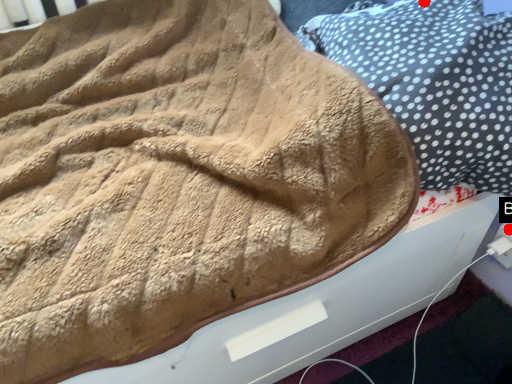
Question: Two points are circled on the image, labeled by A and B beside each circle. Which point is farther to the camera?

Choices:
 (A) A is further
 (B) B is further

Answer: (B)